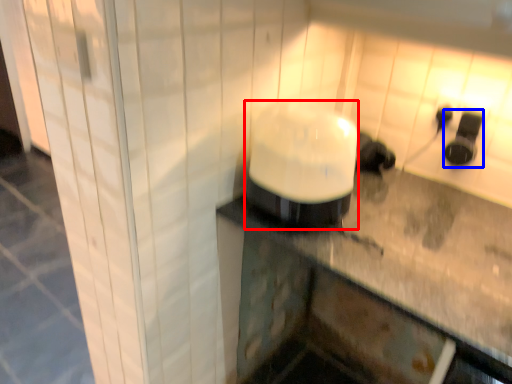
Question: Which object appears closest to the camera in this image, appliance (highlighted by a red box) or appliance (highlighted by a blue box)?

Choices:
 (A) appliance
 (B) appliance

Answer: (A)